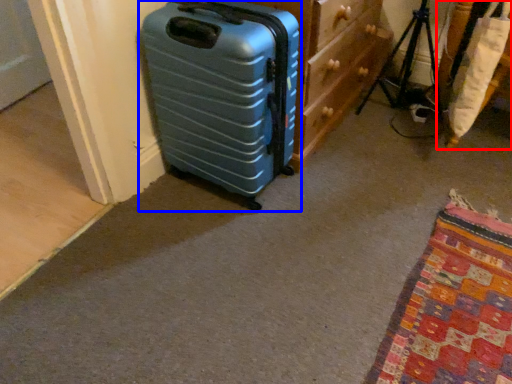
Question: Among these objects, which one is nearest to the camera, furniture (highlighted by a red box) or suitcase (highlighted by a blue box)?

Choices:
 (A) furniture
 (B) suitcase

Answer: (B)